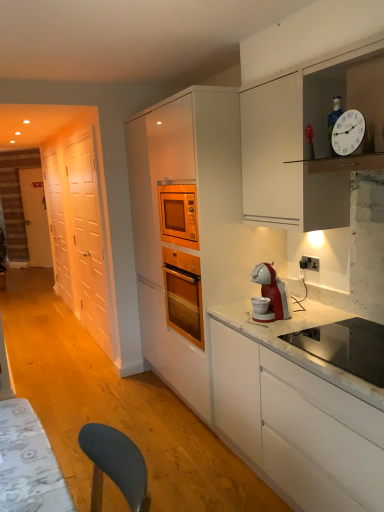
Question: Is stainless steel sink at lower right bigger than black plastic electrical outlet at upper right?

Choices:
 (A) no
 (B) yes

Answer: (B)

Question: Does stainless steel sink at lower right have a greater width compared to black plastic electrical outlet at upper right?

Choices:
 (A) yes
 (B) no

Answer: (A)

Question: Does stainless steel sink at lower right lie behind black plastic electrical outlet at upper right?

Choices:
 (A) yes
 (B) no

Answer: (B)

Question: Would you say stainless steel sink at lower right is outside black plastic electrical outlet at upper right?

Choices:
 (A) yes
 (B) no

Answer: (A)

Question: From the image's perspective, is stainless steel sink at lower right located above black plastic electrical outlet at upper right?

Choices:
 (A) no
 (B) yes

Answer: (A)

Question: In the image, is white wooden door at left on the left side or the right side of white glossy door at left, the first glass door when ordered from back to front?

Choices:
 (A) left
 (B) right

Answer: (A)

Question: In the image, is white wooden door at left positioned in front of or behind white glossy door at left, the first glass door when ordered from back to front?

Choices:
 (A) front
 (B) behind

Answer: (B)

Question: Is white wooden door at left bigger or smaller than white glossy door at left, the first glass door when ordered from back to front?

Choices:
 (A) small
 (B) big

Answer: (B)

Question: Is white wooden door at left spatially inside white glossy door at left, the first glass door when ordered from back to front, or outside of it?

Choices:
 (A) outside
 (B) inside

Answer: (A)

Question: From a real-world perspective, relative to black plastic electrical outlet at upper right, is stainless steel sink at lower right vertically above or below?

Choices:
 (A) below
 (B) above

Answer: (A)

Question: Does point (354, 347) appear closer or farther from the camera than point (304, 266)?

Choices:
 (A) farther
 (B) closer

Answer: (B)

Question: Is stainless steel sink at lower right spatially inside black plastic electrical outlet at upper right, or outside of it?

Choices:
 (A) outside
 (B) inside

Answer: (A)

Question: In terms of size, does stainless steel sink at lower right appear bigger or smaller than black plastic electrical outlet at upper right?

Choices:
 (A) big
 (B) small

Answer: (A)

Question: Considering the positions of white wooden door at left and black plastic electrical outlet at upper right in the image, is white wooden door at left bigger or smaller than black plastic electrical outlet at upper right?

Choices:
 (A) small
 (B) big

Answer: (B)

Question: From the image's perspective, is white wooden door at left located above or below black plastic electrical outlet at upper right?

Choices:
 (A) below
 (B) above

Answer: (B)